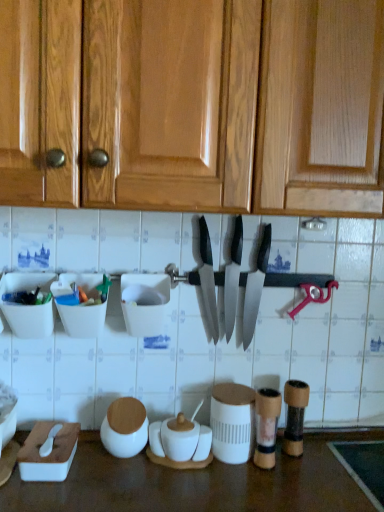
How much space does wooden textured salt and pepper shakers at lower center, marked as the first tableware in a right-to-left arrangement, occupy vertically?

wooden textured salt and pepper shakers at lower center, marked as the first tableware in a right-to-left arrangement, is 7.25 inches tall.

The height and width of the screenshot is (512, 384). What are the coordinates of `polished silver knife at center, the second kitchen knife positioned from the right` in the screenshot? It's located at (233, 278).

The image size is (384, 512). Identify the location of white matte salt and pepper shakers at center. (180, 442).

What do you see at coordinates (144, 303) in the screenshot? This screenshot has width=384, height=512. I see `white plastic container at center, the fourth tableware viewed from the right` at bounding box center [144, 303].

I want to click on wooden salt and pepper shakers at center, which is the fifth tableware from left to right, so click(266, 426).

What do you see at coordinates (255, 287) in the screenshot? I see `matte black knife at center, which appears as the third kitchen knife when viewed from the left` at bounding box center [255, 287].

The height and width of the screenshot is (512, 384). I want to click on polished silver knife at center, which is the 3th kitchen knife from right to left, so click(208, 279).

What is the approximate width of polished silver knife at center, marked as the 1th kitchen knife in a left-to-right arrangement?

It is 4.80 inches.

What are the coordinates of `wooden textured salt and pepper shakers at lower center, which appears as the 6th tableware when viewed from the left` in the screenshot? It's located at (295, 416).

Can you confirm if white plastic container at center, the fourth tableware viewed from the right, is shorter than polished silver knife at center, which is counted as the 2th kitchen knife, starting from the left?

Yes.

Is white plastic container at center, placed as the third tableware when sorted from left to right, aimed at polished silver knife at center, the second kitchen knife positioned from the right?

No, white plastic container at center, placed as the third tableware when sorted from left to right, is not oriented towards polished silver knife at center, the second kitchen knife positioned from the right.

Can you confirm if white plastic container at center, placed as the third tableware when sorted from left to right, is bigger than polished silver knife at center, which is counted as the 2th kitchen knife, starting from the left?

Indeed, white plastic container at center, placed as the third tableware when sorted from left to right, has a larger size compared to polished silver knife at center, which is counted as the 2th kitchen knife, starting from the left.

Can polished silver knife at center, which is counted as the 2th kitchen knife, starting from the left, be found inside white plastic container at center, placed as the third tableware when sorted from left to right?

Result: No.

From the image's perspective, which object appears higher, white matte jar at lower center, positioned as the 5th tableware in right-to-left order, or wooden textured salt and pepper shakers at lower center, marked as the first tableware in a right-to-left arrangement?

From the image's view, wooden textured salt and pepper shakers at lower center, marked as the first tableware in a right-to-left arrangement, is above.

Based on the photo, between white matte jar at lower center, positioned as the 5th tableware in right-to-left order, and wooden textured salt and pepper shakers at lower center, which appears as the 6th tableware when viewed from the left, which one appears on the left side from the viewer's perspective?

From the viewer's perspective, white matte jar at lower center, positioned as the 5th tableware in right-to-left order, appears more on the left side.

Measure the distance between white matte jar at lower center, marked as the 2th tableware in a left-to-right arrangement, and wooden textured salt and pepper shakers at lower center, marked as the first tableware in a right-to-left arrangement.

white matte jar at lower center, marked as the 2th tableware in a left-to-right arrangement, is 15.21 inches away from wooden textured salt and pepper shakers at lower center, marked as the first tableware in a right-to-left arrangement.

Is point (121, 410) farther from camera compared to point (302, 397)?

That is False.

Can you tell me how much white matte salt and pepper shakers at center and white matte jar at lower center, positioned as the 5th tableware in right-to-left order, differ in facing direction?

5.66 degrees separate the facing orientations of white matte salt and pepper shakers at center and white matte jar at lower center, positioned as the 5th tableware in right-to-left order.

From a real-world perspective, count 1st tablewares upward from the white matte salt and pepper shakers at center and point to it. Please provide its 2D coordinates.

[(125, 426)]

Measure the distance from white matte salt and pepper shakers at center to white matte jar at lower center, positioned as the 5th tableware in right-to-left order.

white matte salt and pepper shakers at center is 3.32 inches away from white matte jar at lower center, positioned as the 5th tableware in right-to-left order.

Considering the points (192, 450) and (111, 424), which point is behind, point (192, 450) or point (111, 424)?

Positioned behind is point (111, 424).

Is matte black knife at center, arranged as the 1th kitchen knife when viewed from the right, looking in the opposite direction of white matte container at center, which is the 4th tableware in left-to-right order?

No, matte black knife at center, arranged as the 1th kitchen knife when viewed from the right,'s orientation is not away from white matte container at center, which is the 4th tableware in left-to-right order.

Between matte black knife at center, arranged as the 1th kitchen knife when viewed from the right, and white matte container at center, arranged as the 3th tableware when viewed from the right, which one appears on the right side from the viewer's perspective?

From the viewer's perspective, matte black knife at center, arranged as the 1th kitchen knife when viewed from the right, appears more on the right side.

In terms of height, does matte black knife at center, which appears as the third kitchen knife when viewed from the left, look taller or shorter compared to white matte container at center, arranged as the 3th tableware when viewed from the right?

In the image, matte black knife at center, which appears as the third kitchen knife when viewed from the left, appears to be taller than white matte container at center, arranged as the 3th tableware when viewed from the right.

From the image's perspective, which one is positioned higher, white matte jar at lower center, marked as the 2th tableware in a left-to-right arrangement, or white matte salt and pepper shakers at center?

From the image's view, white matte jar at lower center, marked as the 2th tableware in a left-to-right arrangement, is above.

This screenshot has width=384, height=512. Find the location of `pottery that appears in front of the white matte jar at lower center, marked as the 2th tableware in a left-to-right arrangement`. pottery that appears in front of the white matte jar at lower center, marked as the 2th tableware in a left-to-right arrangement is located at coordinates [180, 442].

Is point (103, 443) positioned after point (200, 404)?

No, it is in front of (200, 404).

Is white matte jar at lower center, marked as the 2th tableware in a left-to-right arrangement, far from white matte salt and pepper shakers at center?

No, white matte jar at lower center, marked as the 2th tableware in a left-to-right arrangement, is not far away from white matte salt and pepper shakers at center.

Is wooden salt and pepper shakers at center, which appears as the second tableware when viewed from the right, not inside white matte salt and pepper shakers at center?

That's correct, wooden salt and pepper shakers at center, which appears as the second tableware when viewed from the right, is outside of white matte salt and pepper shakers at center.

From a real-world perspective, between wooden salt and pepper shakers at center, which is the fifth tableware from left to right, and white matte salt and pepper shakers at center, who is vertically higher?

wooden salt and pepper shakers at center, which is the fifth tableware from left to right, is physically above.

Which of these two, wooden salt and pepper shakers at center, which appears as the second tableware when viewed from the right, or white matte salt and pepper shakers at center, is smaller?

wooden salt and pepper shakers at center, which appears as the second tableware when viewed from the right, is smaller.

Which is less distant, (267,457) or (167,419)?

Point (267,457).

From the image's perspective, which object appears higher, polished silver knife at center, the second kitchen knife positioned from the right, or translucent plastic container at left, the 6th tableware viewed from the right?

polished silver knife at center, the second kitchen knife positioned from the right.

Is polished silver knife at center, which is counted as the 2th kitchen knife, starting from the left, looking in the opposite direction of translucent plastic container at left, the 1th tableware when ordered from left to right?

No, translucent plastic container at left, the 1th tableware when ordered from left to right, is not at the back of polished silver knife at center, which is counted as the 2th kitchen knife, starting from the left.

Which is in front, polished silver knife at center, which is counted as the 2th kitchen knife, starting from the left, or translucent plastic container at left, the 1th tableware when ordered from left to right?

translucent plastic container at left, the 1th tableware when ordered from left to right, is in front.

Find the location of a particular element. This screenshot has height=512, width=384. the 2nd tableware positioned below the polished silver knife at center, which is counted as the 2th kitchen knife, starting from the left (from the image's perspective) is located at coordinates (144, 303).

Locate an element on the screen. Image resolution: width=384 pixels, height=512 pixels. the 2nd tableware positioned above the white matte jar at lower center, positioned as the 5th tableware in right-to-left order (from the image's perspective) is located at coordinates (295, 416).

Considering their positions, is wooden salt and pepper shakers at center, which is the fifth tableware from left to right, positioned further to wooden textured salt and pepper shakers at lower center, which appears as the 6th tableware when viewed from the left, than white matte jar at lower center, positioned as the 5th tableware in right-to-left order?

The object further to wooden textured salt and pepper shakers at lower center, which appears as the 6th tableware when viewed from the left, is white matte jar at lower center, positioned as the 5th tableware in right-to-left order.

Estimate the real-world distances between objects in this image. Which object is closer to polished silver knife at center, marked as the 1th kitchen knife in a left-to-right arrangement, polished silver knife at center, the second kitchen knife positioned from the right, or white matte container at center, which is the 4th tableware in left-to-right order?

polished silver knife at center, the second kitchen knife positioned from the right, lies closer to polished silver knife at center, marked as the 1th kitchen knife in a left-to-right arrangement, than the other object.

Which object lies further to the anchor point wooden textured salt and pepper shakers at lower center, which appears as the 6th tableware when viewed from the left, translucent plastic container at left, the 1th tableware when ordered from left to right, or white plastic container at center, the fourth tableware viewed from the right?

The object further to wooden textured salt and pepper shakers at lower center, which appears as the 6th tableware when viewed from the left, is translucent plastic container at left, the 1th tableware when ordered from left to right.

Considering their positions, is translucent plastic container at left, the 6th tableware viewed from the right, positioned closer to white matte jar at lower center, positioned as the 5th tableware in right-to-left order, than white matte salt and pepper shakers at center?

Based on the image, white matte salt and pepper shakers at center appears to be nearer to white matte jar at lower center, positioned as the 5th tableware in right-to-left order.

Looking at the image, which one is located closer to wooden textured salt and pepper shakers at lower center, which appears as the 6th tableware when viewed from the left, matte black knife at center, arranged as the 1th kitchen knife when viewed from the right, or translucent plastic container at left, the 6th tableware viewed from the right?

matte black knife at center, arranged as the 1th kitchen knife when viewed from the right, lies closer to wooden textured salt and pepper shakers at lower center, which appears as the 6th tableware when viewed from the left, than the other object.

Looking at the image, which one is located closer to white matte salt and pepper shakers at center, white matte jar at lower center, marked as the 2th tableware in a left-to-right arrangement, or white matte container at center, arranged as the 3th tableware when viewed from the right?

white matte container at center, arranged as the 3th tableware when viewed from the right, is positioned closer to the anchor white matte salt and pepper shakers at center.

Considering their positions, is white matte salt and pepper shakers at center positioned closer to white plastic container at center, placed as the third tableware when sorted from left to right, than polished silver knife at center, marked as the 1th kitchen knife in a left-to-right arrangement?

polished silver knife at center, marked as the 1th kitchen knife in a left-to-right arrangement, lies closer to white plastic container at center, placed as the third tableware when sorted from left to right, than the other object.

In the scene shown: Considering their positions, is wooden salt and pepper shakers at center, which is the fifth tableware from left to right, positioned further to matte black knife at center, which appears as the third kitchen knife when viewed from the left, than white matte salt and pepper shakers at center?

Among the two, white matte salt and pepper shakers at center is located further to matte black knife at center, which appears as the third kitchen knife when viewed from the left.

At what (x,y) coordinates should I click in order to perform the action: click on kitchen knife between polished silver knife at center, which is counted as the 2th kitchen knife, starting from the left, and wooden salt and pepper shakers at center, which appears as the second tableware when viewed from the right, in the up-down direction. Please return your answer as a coordinate pair (x, y). Looking at the image, I should click on (255, 287).

Where is `tableware located between white matte salt and pepper shakers at center and wooden salt and pepper shakers at center, which is the fifth tableware from left to right, in the left-right direction`? The height and width of the screenshot is (512, 384). tableware located between white matte salt and pepper shakers at center and wooden salt and pepper shakers at center, which is the fifth tableware from left to right, in the left-right direction is located at coordinates (232, 422).

At what (x,y) coordinates should I click in order to perform the action: click on pottery between white matte jar at lower center, marked as the 2th tableware in a left-to-right arrangement, and wooden textured salt and pepper shakers at lower center, which appears as the 6th tableware when viewed from the left. Please return your answer as a coordinate pair (x, y). This screenshot has width=384, height=512. Looking at the image, I should click on (180, 442).

Locate an element on the screen. The height and width of the screenshot is (512, 384). kitchen knife situated between translucent plastic container at left, the 1th tableware when ordered from left to right, and white matte container at center, arranged as the 3th tableware when viewed from the right, from left to right is located at coordinates (208, 279).